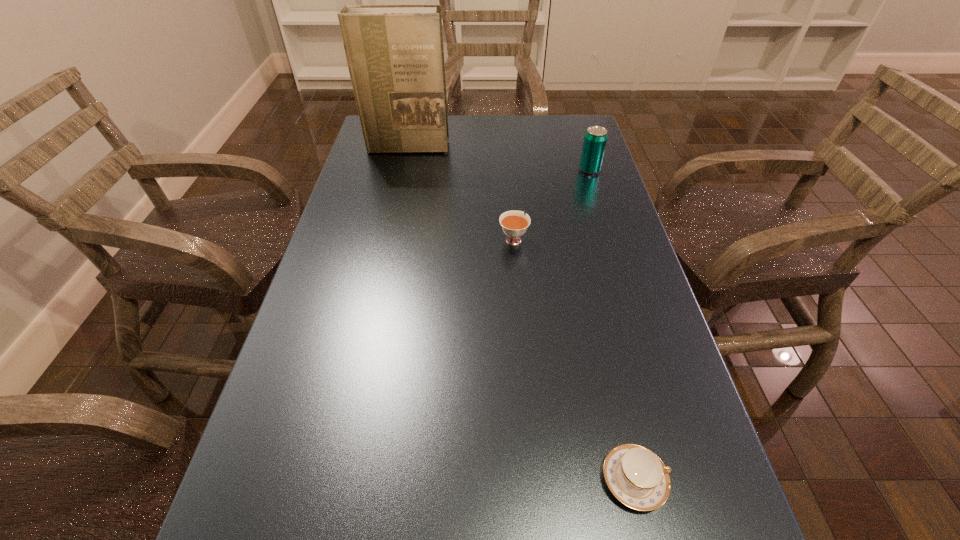
Find the location of `the leftmost object`. the leftmost object is located at coordinates (395, 55).

Find the location of a particular element. The height and width of the screenshot is (540, 960). the tallest object is located at coordinates (395, 55).

Find the location of a particular element. Image resolution: width=960 pixels, height=540 pixels. the second farthest object is located at coordinates (595, 139).

Locate an element on the screen. Image resolution: width=960 pixels, height=540 pixels. beer can is located at coordinates (595, 139).

The image size is (960, 540). Find the location of `the farther teacup`. the farther teacup is located at coordinates (514, 224).

Where is `the third tallest object`? the third tallest object is located at coordinates coord(514,224).

Image resolution: width=960 pixels, height=540 pixels. In order to click on the right teacup in this screenshot , I will do `click(637, 477)`.

Locate an element on the screen. the second object from right to left is located at coordinates (637, 477).

Identify the location of vacant space located 0.350m on the cover of the tallest object. (389, 228).

What are the coordinates of `vacant point located 0.380m on the front of the beer can` in the screenshot? It's located at (620, 269).